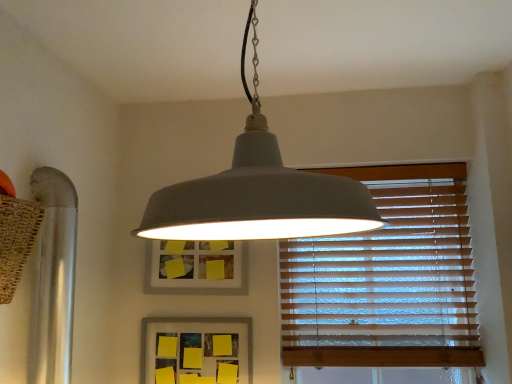
The width and height of the screenshot is (512, 384). Describe the element at coordinates (386, 279) in the screenshot. I see `wooden blinds at right` at that location.

Identify the location of wooden blinds at right. (386, 279).

Describe the element at coordinates (259, 194) in the screenshot. I see `matte gray pendant light at center` at that location.

Find the location of a particular element. yellow matte picture frame at center, which appears as the second picture frame when viewed from the top is located at coordinates (196, 350).

Is wooden blinds at right directly adjacent to yellow matte picture frame at center, which appears as the 1th picture frame when ordered from the bottom?

wooden blinds at right is not next to yellow matte picture frame at center, which appears as the 1th picture frame when ordered from the bottom, and they're not touching.

Looking at this image, could you tell me if wooden blinds at right is facing yellow matte picture frame at center, which appears as the second picture frame when viewed from the top?

No, wooden blinds at right is not oriented towards yellow matte picture frame at center, which appears as the second picture frame when viewed from the top.

Does wooden blinds at right have a lesser width compared to yellow matte picture frame at center, which appears as the 1th picture frame when ordered from the bottom?

No, wooden blinds at right is not thinner than yellow matte picture frame at center, which appears as the 1th picture frame when ordered from the bottom.

From the picture: Does wooden blinds at right have a larger size compared to yellow matte picture frame at center, which appears as the 1th picture frame when ordered from the bottom?

Yes, wooden blinds at right is bigger than yellow matte picture frame at center, which appears as the 1th picture frame when ordered from the bottom.

Choose the correct answer: Is matte gray pendant light at center inside matte gray picture frame at center, the second picture frame ordered from the bottom, or outside it?

matte gray pendant light at center is located beyond the bounds of matte gray picture frame at center, the second picture frame ordered from the bottom.

Does matte gray pendant light at center have a larger size compared to matte gray picture frame at center, acting as the first picture frame starting from the top?

Correct, matte gray pendant light at center is larger in size than matte gray picture frame at center, acting as the first picture frame starting from the top.

From a real-world perspective, is matte gray pendant light at center beneath matte gray picture frame at center, the second picture frame ordered from the bottom?

Incorrect, from a real-world perspective, matte gray pendant light at center is higher than matte gray picture frame at center, the second picture frame ordered from the bottom.

Which of these two, matte gray pendant light at center or matte gray picture frame at center, the second picture frame ordered from the bottom, is thinner?

matte gray picture frame at center, the second picture frame ordered from the bottom, is thinner.

Is wooden blinds at right next to matte gray pendant light at center?

No, wooden blinds at right is not in contact with matte gray pendant light at center.

Is point (332, 290) closer or farther from the camera than point (181, 216)?

Point (332, 290) is positioned farther from the camera compared to point (181, 216).

Which object is closer to the camera taking this photo, wooden blinds at right or matte gray pendant light at center?

Positioned in front is matte gray pendant light at center.

From the picture: From a real-world perspective, is wooden blinds at right under matte gray pendant light at center?

Yes.

From a real-world perspective, does yellow matte picture frame at center, which appears as the 1th picture frame when ordered from the bottom, stand above wooden blinds at right?

No, from a real-world perspective, yellow matte picture frame at center, which appears as the 1th picture frame when ordered from the bottom, is not above wooden blinds at right.

From the image's perspective, is yellow matte picture frame at center, which appears as the 1th picture frame when ordered from the bottom, above or below wooden blinds at right?

From the image's perspective, yellow matte picture frame at center, which appears as the 1th picture frame when ordered from the bottom, appears below wooden blinds at right.

Is yellow matte picture frame at center, which appears as the second picture frame when viewed from the top, closer to camera compared to wooden blinds at right?

Yes, yellow matte picture frame at center, which appears as the second picture frame when viewed from the top, is closer to the viewer.

Is yellow matte picture frame at center, which appears as the second picture frame when viewed from the top, to the left of wooden blinds at right from the viewer's perspective?

Indeed, yellow matte picture frame at center, which appears as the second picture frame when viewed from the top, is positioned on the left side of wooden blinds at right.

Which of these two, matte gray picture frame at center, the second picture frame ordered from the bottom, or wooden blinds at right, is bigger?

With larger size is wooden blinds at right.

Can you confirm if matte gray picture frame at center, the second picture frame ordered from the bottom, is thinner than wooden blinds at right?

Correct, the width of matte gray picture frame at center, the second picture frame ordered from the bottom, is less than that of wooden blinds at right.

From the image's perspective, is matte gray picture frame at center, acting as the first picture frame starting from the top, on wooden blinds at right?

Indeed, from the image's perspective, matte gray picture frame at center, acting as the first picture frame starting from the top, is shown above wooden blinds at right.

In the image, there is a matte gray picture frame at center, the second picture frame ordered from the bottom. Identify the location of window blind below it (from a real-world perspective). (386, 279).

From a real-world perspective, who is located higher, wooden blinds at right or matte gray picture frame at center, the second picture frame ordered from the bottom?

In real-world perspective, matte gray picture frame at center, the second picture frame ordered from the bottom, is above.

Is wooden blinds at right next to matte gray picture frame at center, acting as the first picture frame starting from the top, and touching it?

No, wooden blinds at right is not making contact with matte gray picture frame at center, acting as the first picture frame starting from the top.

In the scene shown: Is wooden blinds at right facing towards matte gray picture frame at center, the second picture frame ordered from the bottom?

No, wooden blinds at right is not facing towards matte gray picture frame at center, the second picture frame ordered from the bottom.

Which is behind, yellow matte picture frame at center, which appears as the second picture frame when viewed from the top, or matte gray pendant light at center?

yellow matte picture frame at center, which appears as the second picture frame when viewed from the top, is further from the camera.

Are yellow matte picture frame at center, which appears as the second picture frame when viewed from the top, and matte gray pendant light at center making contact?

No, yellow matte picture frame at center, which appears as the second picture frame when viewed from the top, is not with matte gray pendant light at center.

From a real-world perspective, does yellow matte picture frame at center, which appears as the second picture frame when viewed from the top, sit lower than matte gray pendant light at center?

Indeed, from a real-world perspective, yellow matte picture frame at center, which appears as the second picture frame when viewed from the top, is positioned beneath matte gray pendant light at center.

Considering the relative sizes of yellow matte picture frame at center, which appears as the 1th picture frame when ordered from the bottom, and matte gray pendant light at center in the image provided, is yellow matte picture frame at center, which appears as the 1th picture frame when ordered from the bottom, shorter than matte gray pendant light at center?

Yes, yellow matte picture frame at center, which appears as the 1th picture frame when ordered from the bottom, is shorter than matte gray pendant light at center.

You are a GUI agent. You are given a task and a screenshot of the screen. Output one action in this format:
    pyautogui.click(x=<x>, y=<y>)
    Task: Click on the window blind behind the yellow matte picture frame at center, which appears as the second picture frame when viewed from the top
    
    Given the screenshot: What is the action you would take?
    (386, 279)

Image resolution: width=512 pixels, height=384 pixels. I want to click on lamp lying in front of the matte gray picture frame at center, the second picture frame ordered from the bottom, so click(x=259, y=194).

Based on their spatial positions, is wooden blinds at right or matte gray pendant light at center closer to matte gray picture frame at center, the second picture frame ordered from the bottom?

wooden blinds at right.

Looking at the image, which one is located further to yellow matte picture frame at center, which appears as the second picture frame when viewed from the top, matte gray picture frame at center, the second picture frame ordered from the bottom, or wooden blinds at right?

wooden blinds at right is positioned further to the anchor yellow matte picture frame at center, which appears as the second picture frame when viewed from the top.

Which object lies further to the anchor point yellow matte picture frame at center, which appears as the second picture frame when viewed from the top, wooden blinds at right or matte gray pendant light at center?

Among the two, matte gray pendant light at center is located further to yellow matte picture frame at center, which appears as the second picture frame when viewed from the top.

Estimate the real-world distances between objects in this image. Which object is further from yellow matte picture frame at center, which appears as the second picture frame when viewed from the top, wooden blinds at right or matte gray picture frame at center, the second picture frame ordered from the bottom?

Based on the image, wooden blinds at right appears to be further to yellow matte picture frame at center, which appears as the second picture frame when viewed from the top.

Looking at the image, which one is located further to wooden blinds at right, yellow matte picture frame at center, which appears as the 1th picture frame when ordered from the bottom, or matte gray picture frame at center, acting as the first picture frame starting from the top?

yellow matte picture frame at center, which appears as the 1th picture frame when ordered from the bottom.

From the image, which object appears to be nearer to wooden blinds at right, matte gray picture frame at center, the second picture frame ordered from the bottom, or yellow matte picture frame at center, which appears as the 1th picture frame when ordered from the bottom?

The object closer to wooden blinds at right is matte gray picture frame at center, the second picture frame ordered from the bottom.

When comparing their distances from matte gray pendant light at center, does matte gray picture frame at center, acting as the first picture frame starting from the top, or yellow matte picture frame at center, which appears as the 1th picture frame when ordered from the bottom, seem further?

yellow matte picture frame at center, which appears as the 1th picture frame when ordered from the bottom.

Looking at the image, which one is located closer to matte gray pendant light at center, wooden blinds at right or matte gray picture frame at center, acting as the first picture frame starting from the top?

The object closer to matte gray pendant light at center is matte gray picture frame at center, acting as the first picture frame starting from the top.

Locate an element on the screen. picture frame between matte gray pendant light at center and wooden blinds at right along the z-axis is located at coordinates (196, 350).

Locate an element on the screen. The image size is (512, 384). picture frame between matte gray pendant light at center and matte gray picture frame at center, the second picture frame ordered from the bottom, in the front-back direction is located at coordinates (196, 350).

I want to click on window blind positioned between matte gray pendant light at center and matte gray picture frame at center, the second picture frame ordered from the bottom, from near to far, so click(x=386, y=279).

Find the location of a particular element. picture frame between matte gray picture frame at center, the second picture frame ordered from the bottom, and wooden blinds at right, in the horizontal direction is located at coordinates (196, 350).